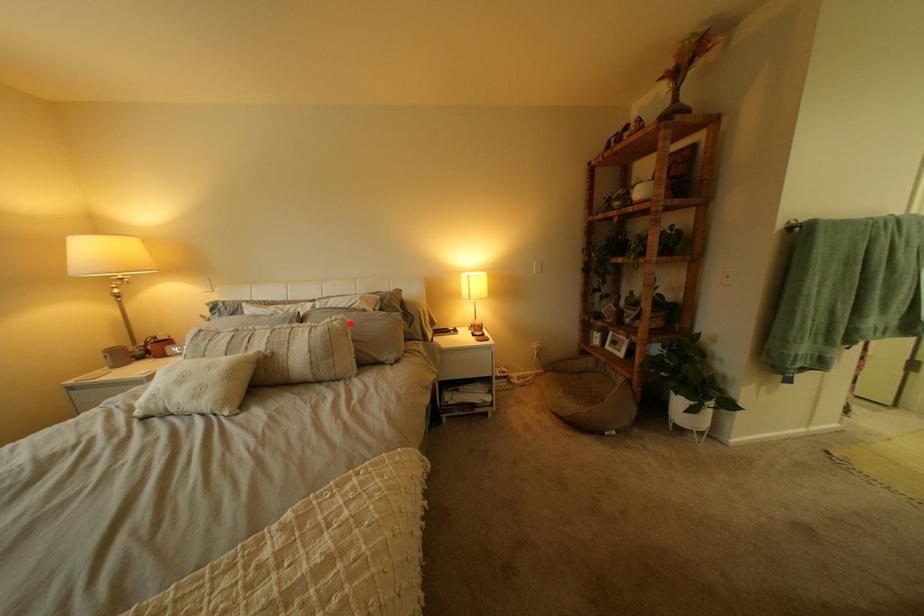
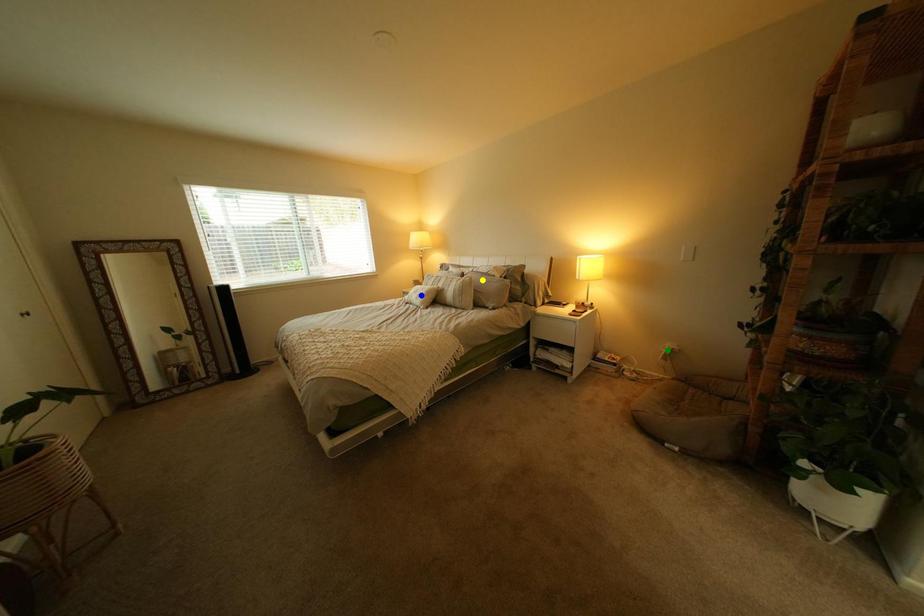
Question: I am providing you with two images of the same scene from different viewpoints. A red point is marked on the first image. You are given multiple points on the second image. Which spot in image 2 lines up with the point in image 1?

Choices:
 (A) blue point
 (B) green point
 (C) yellow point

Answer: (C)